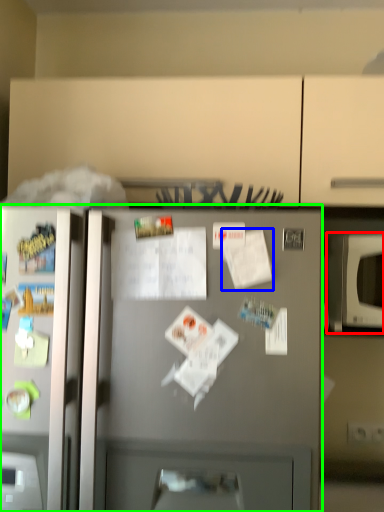
Question: Which object is the farthest from microwave oven (highlighted by a red box)? Choose among these: paper (highlighted by a blue box) or refrigerator (highlighted by a green box).

Choices:
 (A) paper
 (B) refrigerator

Answer: (B)